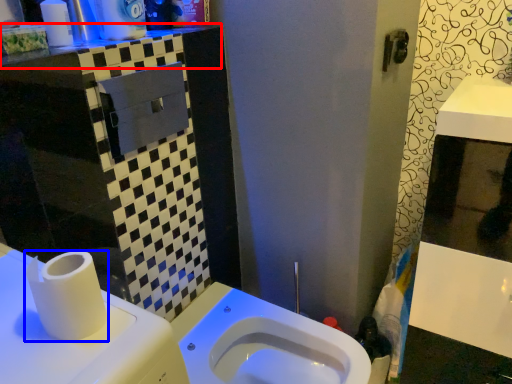
Question: Which object is further to the camera taking this photo, counter top (highlighted by a red box) or toilet paper (highlighted by a blue box)?

Choices:
 (A) counter top
 (B) toilet paper

Answer: (A)